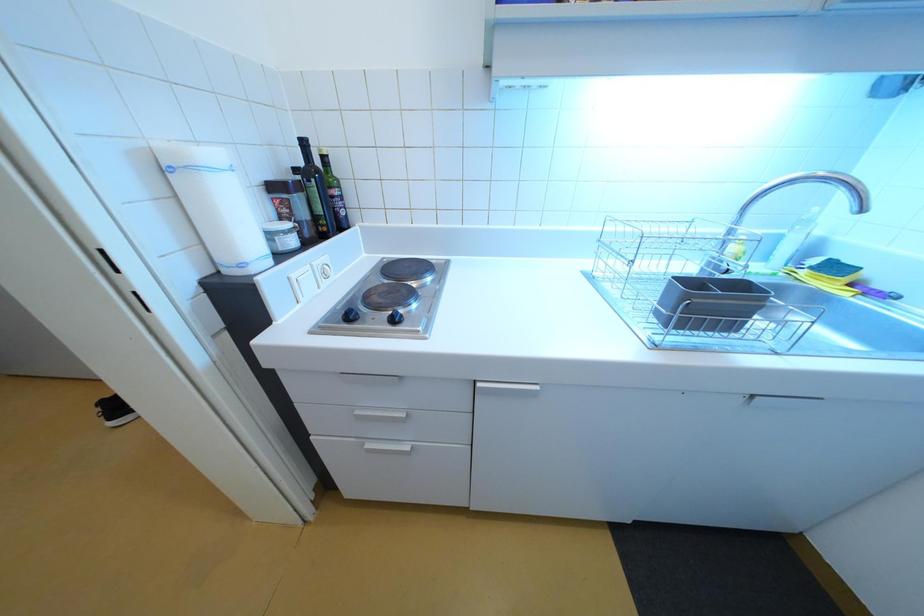
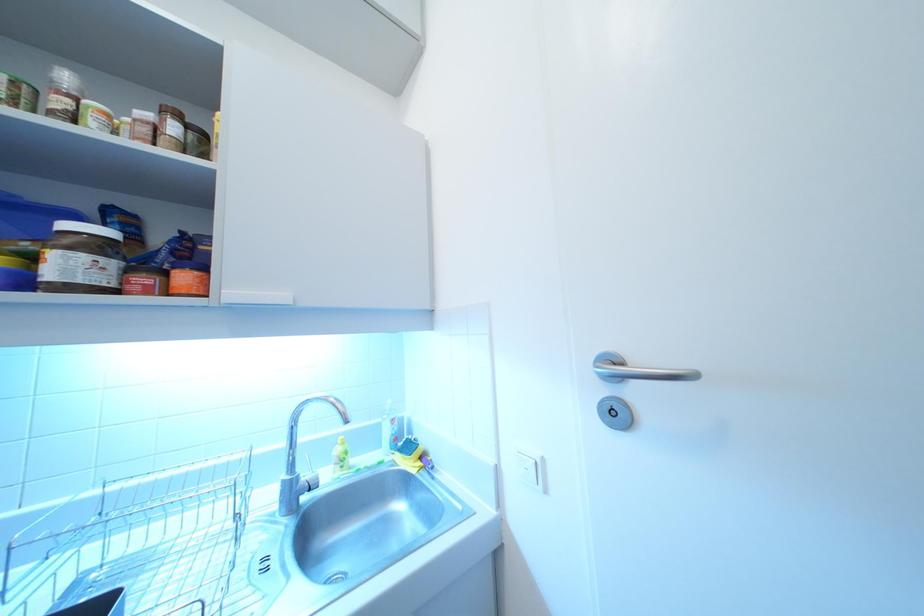
The first image is from the beginning of the video and the second image is from the end. How did the camera likely rotate when shooting the video?

The camera rotated toward right-up.